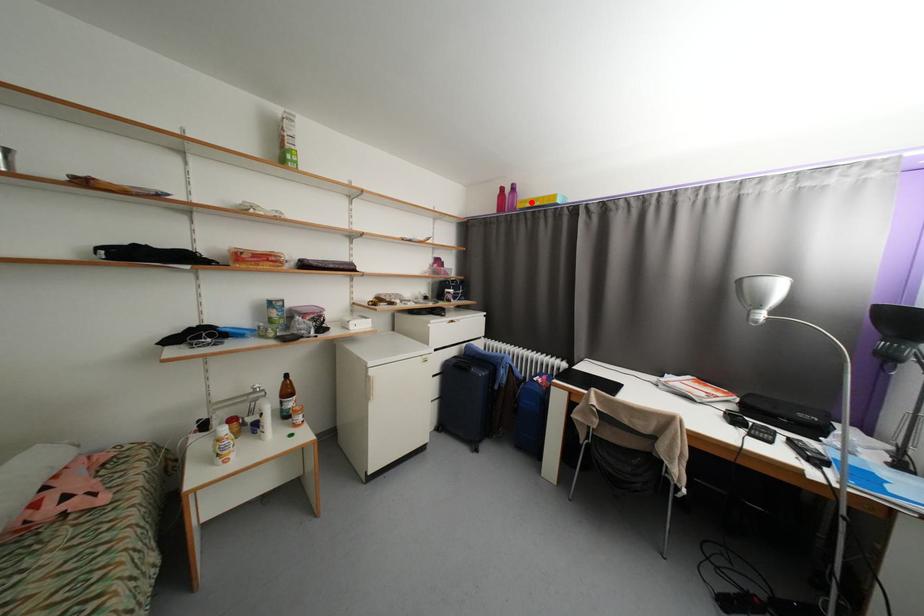
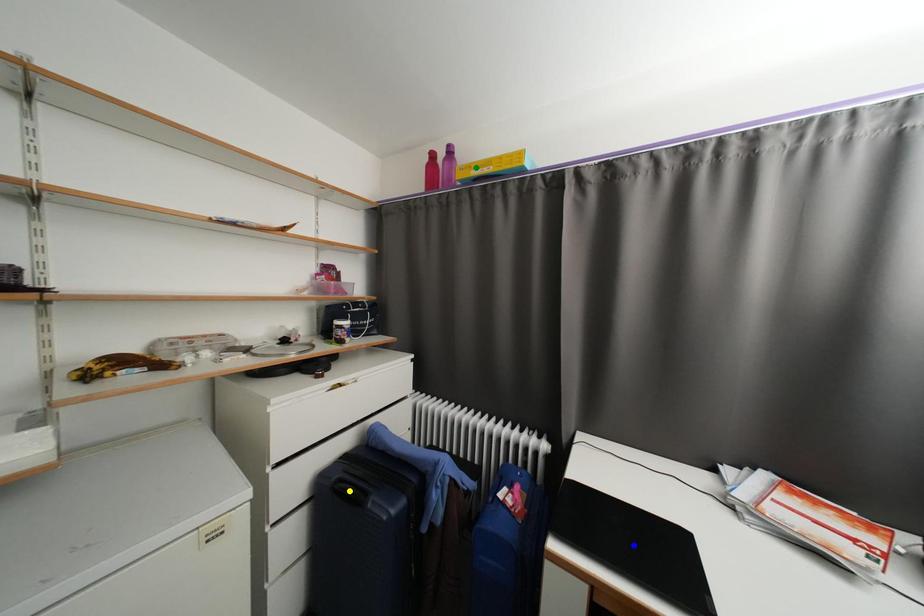
Question: I am providing you with two images of the same scene from different viewpoints. A red point is marked on the first image. You are given multiple points on the second image. In image 2, which mark is for the same physical point as the one in image 1?

Choices:
 (A) green point
 (B) blue point
 (C) yellow point

Answer: (A)